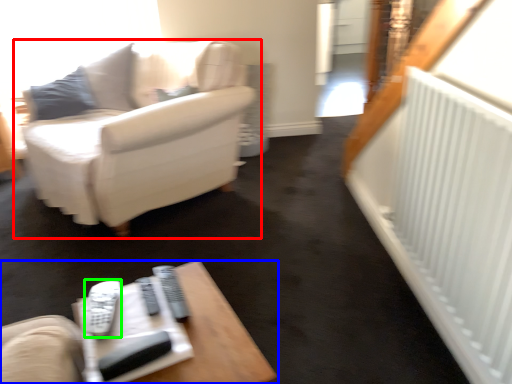
Question: Which object is the farthest from studio couch (highlighted by a red box)? Choose among these: table (highlighted by a blue box) or remote (highlighted by a green box).

Choices:
 (A) table
 (B) remote

Answer: (A)